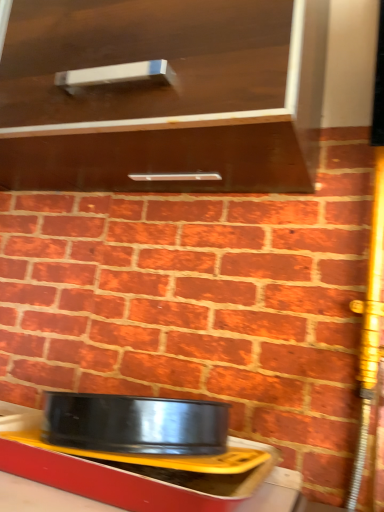
Question: From the image's perspective, is matte brown cabinet at upper center positioned above or below metallic yellow tray at lower center?

Choices:
 (A) below
 (B) above

Answer: (B)

Question: From their relative heights in the image, would you say matte brown cabinet at upper center is taller or shorter than metallic yellow tray at lower center?

Choices:
 (A) tall
 (B) short

Answer: (A)

Question: Is matte brown cabinet at upper center inside the boundaries of metallic yellow tray at lower center, or outside?

Choices:
 (A) outside
 (B) inside

Answer: (A)

Question: From the image's perspective, is metallic yellow tray at lower center positioned above or below matte brown cabinet at upper center?

Choices:
 (A) below
 (B) above

Answer: (A)

Question: In terms of width, does metallic yellow tray at lower center look wider or thinner when compared to matte brown cabinet at upper center?

Choices:
 (A) thin
 (B) wide

Answer: (A)

Question: Is point click(x=142, y=466) positioned closer to the camera than point click(x=1, y=125)?

Choices:
 (A) farther
 (B) closer

Answer: (B)

Question: Considering the positions of metallic yellow tray at lower center and matte brown cabinet at upper center in the image, is metallic yellow tray at lower center taller or shorter than matte brown cabinet at upper center?

Choices:
 (A) tall
 (B) short

Answer: (B)